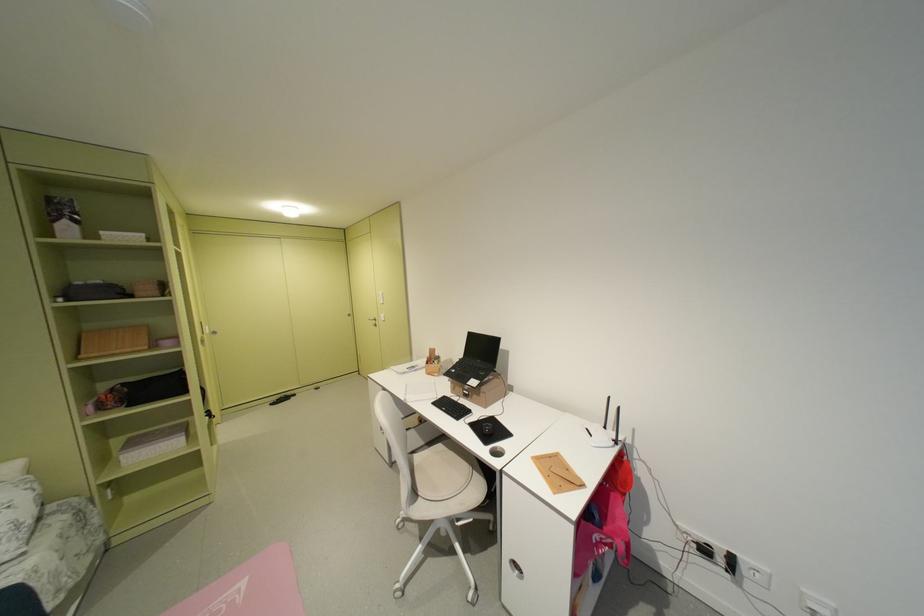
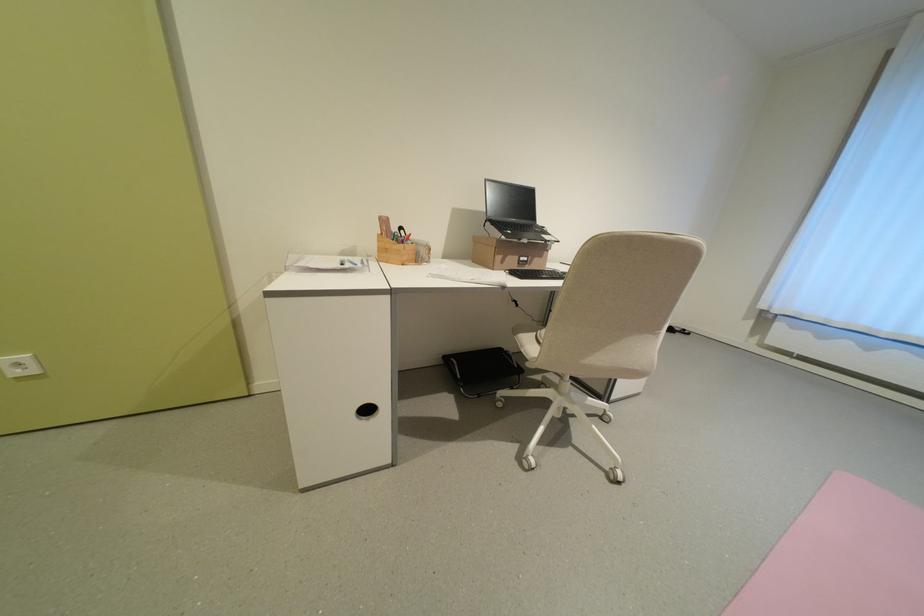
The point at (x=477, y=394) is marked in the first image. Where is the corresponding point in the second image?

(536, 261)